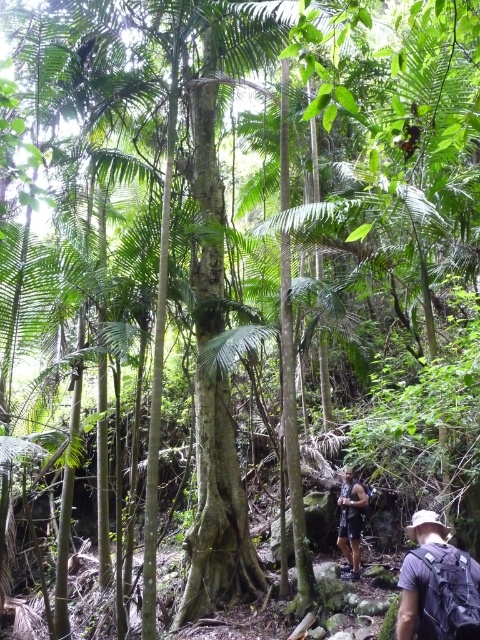
Is point (443, 616) positioned behind point (359, 568)?

That is False.

Who is higher up, gray fabric backpack at lower right or dark brown leather backpack at lower right?

gray fabric backpack at lower right is above.

Does point (468, 573) lie in front of point (360, 509)?

Yes, point (468, 573) is closer to viewer.

This screenshot has width=480, height=640. In order to click on gray fabric backpack at lower right in this screenshot , I will do pos(419,602).